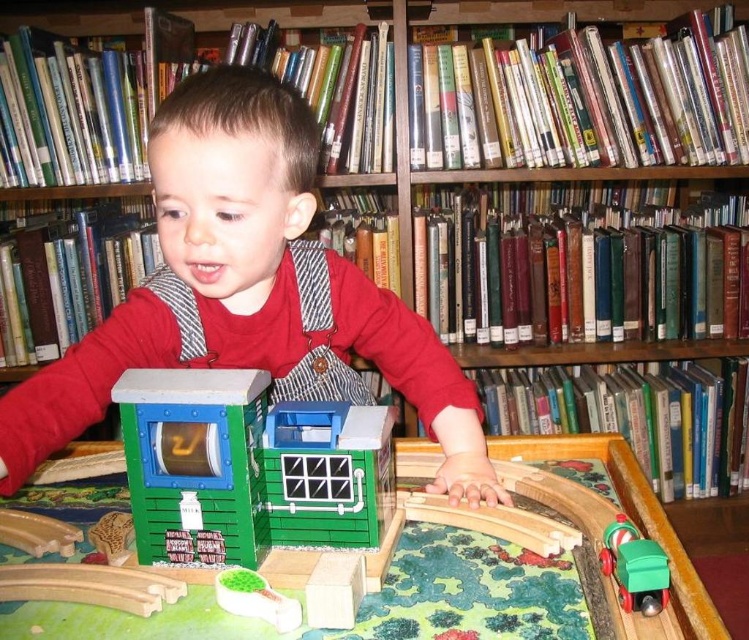
Who is positioned more to the left, green plastic building at center or green plastic train at lower right?

green plastic building at center is more to the left.

Does green plastic building at center appear on the right side of green plastic train at lower right?

No, green plastic building at center is not to the right of green plastic train at lower right.

Is point (209, 561) farther from viewer compared to point (654, 592)?

Yes, point (209, 561) is behind point (654, 592).

Where is `green plastic building at center`? The height and width of the screenshot is (640, 749). green plastic building at center is located at coordinates (248, 468).